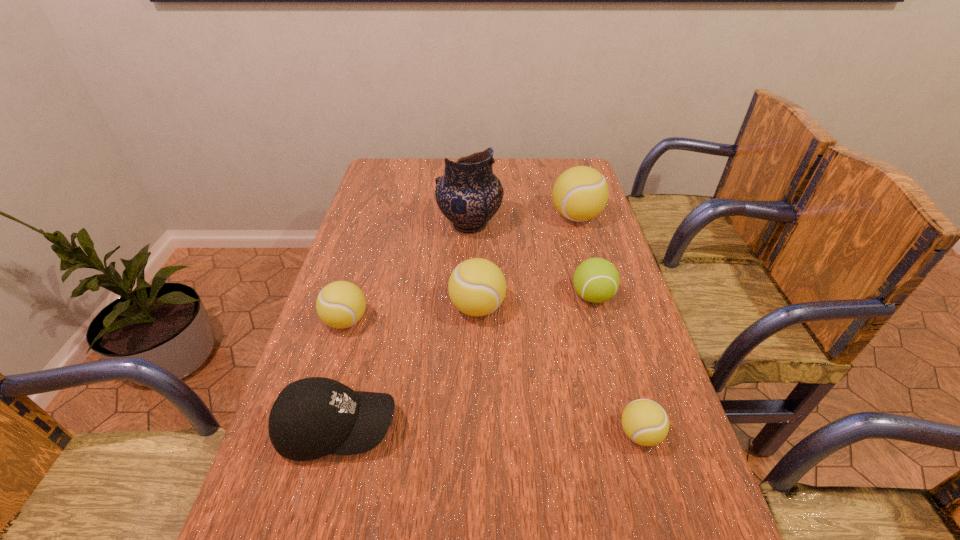
Where is `tennis ball that is at the left edge`? This screenshot has width=960, height=540. tennis ball that is at the left edge is located at coordinates (341, 304).

In the image, there is a desktop. Find the location of `vacant space at the far edge`. vacant space at the far edge is located at coordinates click(419, 176).

I want to click on vacant space at the left edge of the desktop, so click(x=391, y=246).

Image resolution: width=960 pixels, height=540 pixels. I want to click on vacant space at the right edge of the desktop, so click(x=621, y=305).

Where is `vacant space at the far left corner of the desktop`? vacant space at the far left corner of the desktop is located at coordinates (400, 184).

Find the location of a particular element. vacant area that lies between the green tennis ball and the farthest tennis ball is located at coordinates tap(585, 256).

The width and height of the screenshot is (960, 540). What are the coordinates of `free spot between the nearest yellow tennis ball and the green tennis ball` in the screenshot? It's located at (616, 365).

Locate an element on the screen. unoccupied position between the smallest yellow tennis ball and the pottery is located at coordinates (555, 329).

Find the location of a particular element. The height and width of the screenshot is (540, 960). free spot between the black baseball cap and the nearest yellow tennis ball is located at coordinates (489, 431).

The width and height of the screenshot is (960, 540). I want to click on free space between the green tennis ball and the fifth shortest object, so click(535, 302).